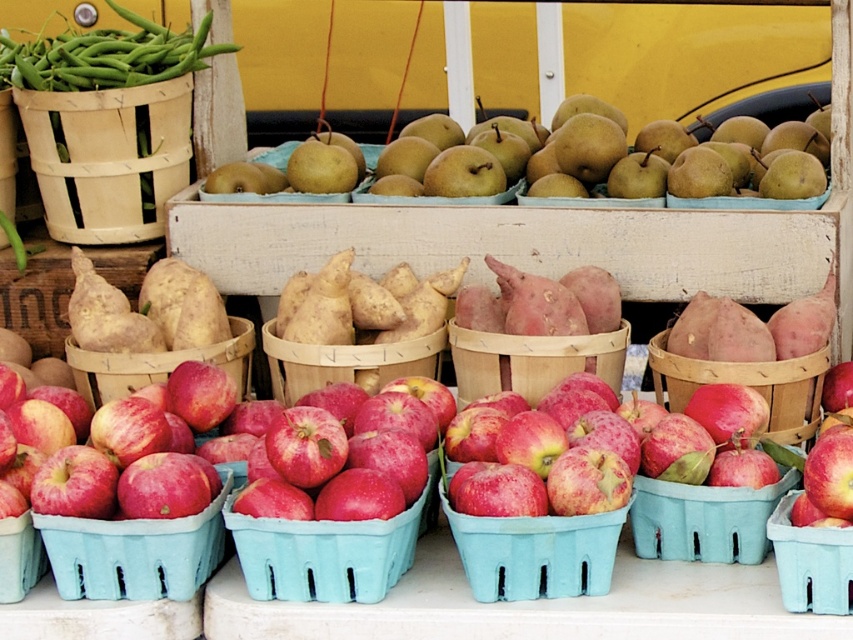
You are a customer at the market stall looking for apples. You see the matte plastic apples at lower left and the natural brown basket at center. Which one is located closer to the front of the table?

The matte plastic apples at lower left is located closer to the front of the table because it is below the natural brown basket at center, meaning it is positioned in front.

You are a customer at the market stall and want to buy both the matte brown pears at center and the matte plastic apples at center. Which one is located to the right side of the other?

The matte brown pears at center are to the right of the matte plastic apples at center.